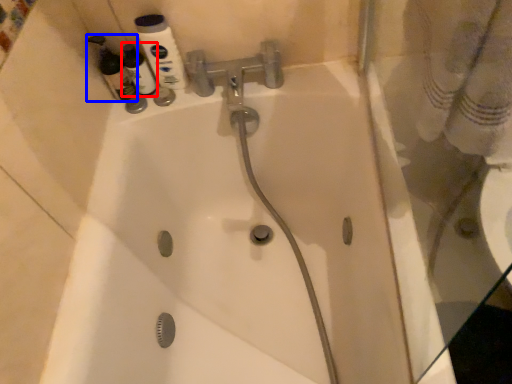
Question: Which of the following is the closest to the observer, cleaning product (highlighted by a red box) or cleaning product (highlighted by a blue box)?

Choices:
 (A) cleaning product
 (B) cleaning product

Answer: (B)